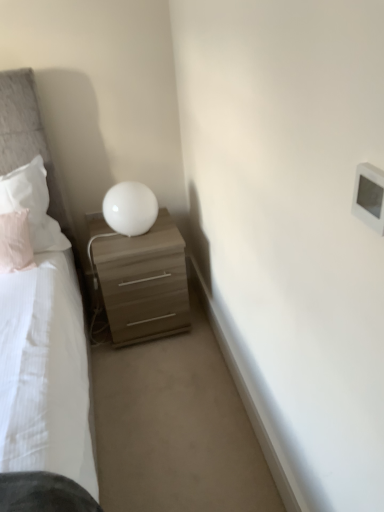
Question: Is white soft pillow at left, which appears as the second pillow when ordered from the bottom, oriented away from white plastic light switch at upper right?

Choices:
 (A) yes
 (B) no

Answer: (B)

Question: Is white soft pillow at left, which appears as the second pillow when ordered from the bottom, completely or partially outside of white plastic light switch at upper right?

Choices:
 (A) yes
 (B) no

Answer: (A)

Question: Does white soft pillow at left, which appears as the second pillow when ordered from the bottom, have a larger size compared to white plastic light switch at upper right?

Choices:
 (A) yes
 (B) no

Answer: (A)

Question: Considering the relative positions of white soft pillow at left, which appears as the second pillow when ordered from the bottom, and white plastic light switch at upper right in the image provided, is white soft pillow at left, which appears as the second pillow when ordered from the bottom, behind white plastic light switch at upper right?

Choices:
 (A) no
 (B) yes

Answer: (B)

Question: From the image's perspective, does white soft pillow at left, which appears as the second pillow when ordered from the bottom, appear lower than white plastic light switch at upper right?

Choices:
 (A) yes
 (B) no

Answer: (B)

Question: Is white soft pillow at left, acting as the 1th pillow starting from the top, positioned before white plastic light switch at upper right?

Choices:
 (A) no
 (B) yes

Answer: (A)

Question: Can you see pink fabric pillow at left, which ranks as the second pillow in top-to-bottom order, touching white glossy sphere at upper right?

Choices:
 (A) no
 (B) yes

Answer: (A)

Question: Considering the relative sizes of pink fabric pillow at left, which ranks as the second pillow in top-to-bottom order, and white glossy sphere at upper right in the image provided, is pink fabric pillow at left, which ranks as the second pillow in top-to-bottom order, thinner than white glossy sphere at upper right?

Choices:
 (A) no
 (B) yes

Answer: (B)

Question: Are pink fabric pillow at left, which ranks as the second pillow in top-to-bottom order, and white glossy sphere at upper right far apart?

Choices:
 (A) yes
 (B) no

Answer: (B)

Question: Considering the relative positions of pink fabric pillow at left, which ranks as the second pillow in top-to-bottom order, and white glossy sphere at upper right in the image provided, is pink fabric pillow at left, which ranks as the second pillow in top-to-bottom order, in front of white glossy sphere at upper right?

Choices:
 (A) yes
 (B) no

Answer: (A)

Question: From a real-world perspective, does pink fabric pillow at left, which ranks as the second pillow in top-to-bottom order, stand above white glossy sphere at upper right?

Choices:
 (A) no
 (B) yes

Answer: (A)

Question: From a real-world perspective, is pink fabric pillow at left, the 1th pillow in the bottom-to-top sequence, beneath white glossy sphere at upper right?

Choices:
 (A) no
 (B) yes

Answer: (B)

Question: Does white plastic light switch at upper right have a larger size compared to light brown wood nightstand at center?

Choices:
 (A) yes
 (B) no

Answer: (B)